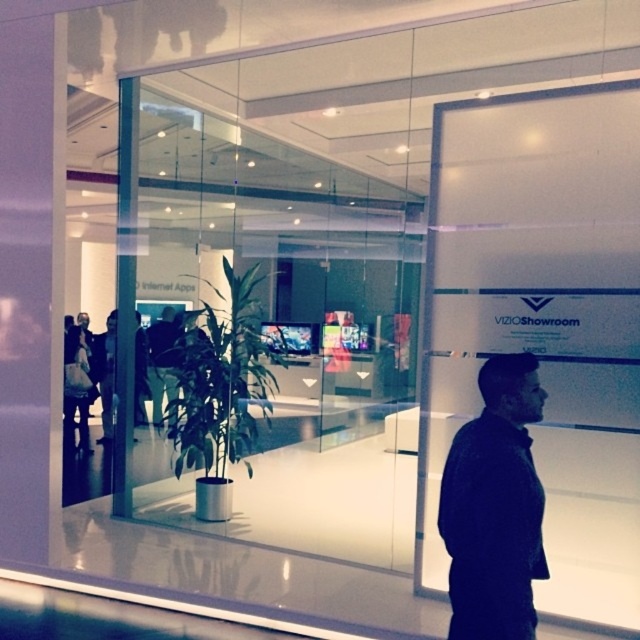
Is dark blue fabric at center above green leafy plant at center?

Actually, dark blue fabric at center is below green leafy plant at center.

Does dark blue fabric at center have a greater width compared to green leafy plant at center?

Incorrect, dark blue fabric at center's width does not surpass green leafy plant at center's.

Who is more distant from viewer, (x=493, y=550) or (x=177, y=477)?

Point (x=177, y=477)

This screenshot has height=640, width=640. In order to click on dark blue fabric at center in this screenshot , I will do `click(493, 506)`.

The image size is (640, 640). What do you see at coordinates (273, 333) in the screenshot? I see `transparent glass door at center` at bounding box center [273, 333].

Can you confirm if transparent glass door at center is thinner than green leafy plant at center?

No, transparent glass door at center is not thinner than green leafy plant at center.

What do you see at coordinates (273, 333) in the screenshot?
I see `transparent glass door at center` at bounding box center [273, 333].

Find the location of `transparent glass door at center`. transparent glass door at center is located at coordinates (273, 333).

Who is lower down, green leafy plant at center or black leather jacket at center?

Positioned lower is black leather jacket at center.

Can you confirm if green leafy plant at center is bigger than black leather jacket at center?

Actually, green leafy plant at center might be smaller than black leather jacket at center.

Identify the location of green leafy plant at center. The height and width of the screenshot is (640, 640). (220, 376).